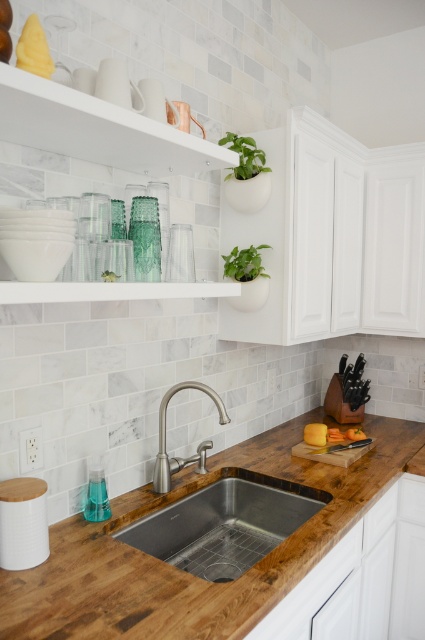
Question: Which point appears farthest from the camera in this image?

Choices:
 (A) (206, 529)
 (B) (176, 460)

Answer: (A)

Question: Can you confirm if stainless steel sink at center is wider than green matte plant at upper center?

Choices:
 (A) no
 (B) yes

Answer: (B)

Question: Which of the following is the farthest from the observer?

Choices:
 (A) (238, 266)
 (B) (311, 520)
 (C) (153, 481)

Answer: (A)

Question: Does stainless steel sink at center have a greater width compared to brushed nickel faucet at center?

Choices:
 (A) yes
 (B) no

Answer: (A)

Question: Is wooden countertop at center in front of green matte plant at upper center?

Choices:
 (A) no
 (B) yes

Answer: (B)

Question: Which object appears closest to the camera in this image?

Choices:
 (A) stainless steel sink at center
 (B) wooden countertop at center
 (C) brushed nickel faucet at center
 (D) green leafy plant at upper center

Answer: (B)